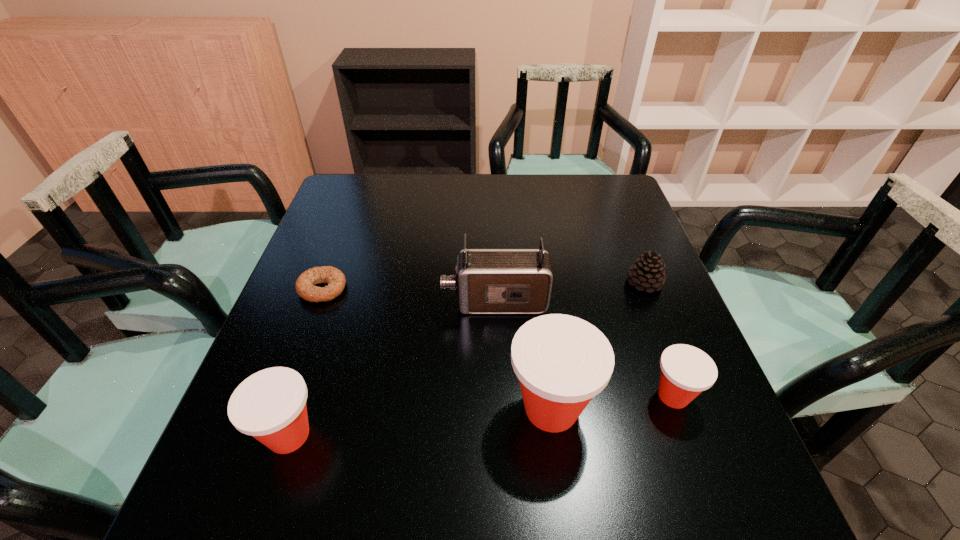
You are a GUI agent. You are given a task and a screenshot of the screen. Output one action in this format:
    pyautogui.click(x=<x>, y=<y>)
    Task: Click on the object positioned at the near right corner
    
    Given the screenshot: What is the action you would take?
    pyautogui.click(x=686, y=371)

Locate an element on the screen. vacant space at the far edge of the desktop is located at coordinates (393, 211).

The width and height of the screenshot is (960, 540). What are the coordinates of `vacant point at the near edge` in the screenshot? It's located at (328, 411).

In the image, there is a desktop. In order to click on vacant space at the left edge in this screenshot , I will do `click(314, 252)`.

Locate an element on the screen. This screenshot has width=960, height=540. vacant space at the right edge is located at coordinates (649, 242).

The width and height of the screenshot is (960, 540). In order to click on vacant space at the far left corner in this screenshot , I will do `click(351, 192)`.

Find the location of a particular element. The height and width of the screenshot is (540, 960). vacant space at the near left corner is located at coordinates (252, 448).

You are a GUI agent. You are given a task and a screenshot of the screen. Output one action in this format:
    pyautogui.click(x=<x>, y=<y>)
    Task: Click on the free space at the far right corner
    This screenshot has height=540, width=960.
    Given the screenshot: What is the action you would take?
    pyautogui.click(x=599, y=203)

The width and height of the screenshot is (960, 540). I want to click on vacant space in between the shortest Dixie cup and the second shortest Dixie cup, so click(481, 415).

Locate an element on the screen. The width and height of the screenshot is (960, 540). vacant area that lies between the second Dixie cup from left to right and the bagel is located at coordinates (437, 348).